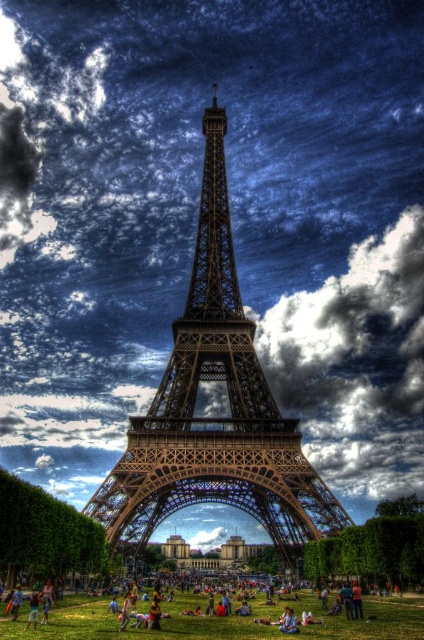
Question: Does brown metallic eiffel tower at center have a smaller size compared to green grass at lower center?

Choices:
 (A) yes
 (B) no

Answer: (B)

Question: Does brown metallic eiffel tower at center appear on the left side of green grass at lower center?

Choices:
 (A) no
 (B) yes

Answer: (B)

Question: Which point is closer to the camera?

Choices:
 (A) click(367, 630)
 (B) click(139, 497)

Answer: (A)

Question: Can you confirm if brown metallic eiffel tower at center is smaller than green grass at lower center?

Choices:
 (A) yes
 (B) no

Answer: (B)

Question: Which object appears closest to the camera in this image?

Choices:
 (A) green grass at lower center
 (B) brown metallic eiffel tower at center

Answer: (A)